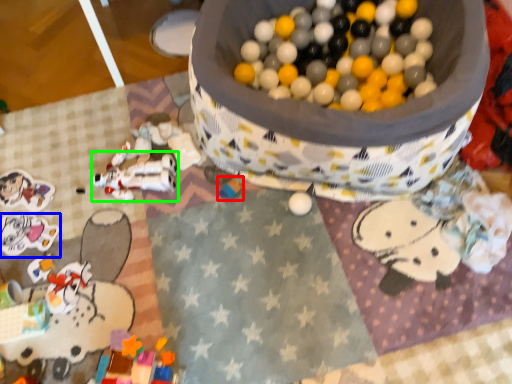
Question: Estimate the real-world distances between objects in this image. Which object is farther from toy (highlighted by a red box), toy (highlighted by a blue box) or toy (highlighted by a green box)?

Choices:
 (A) toy
 (B) toy

Answer: (A)